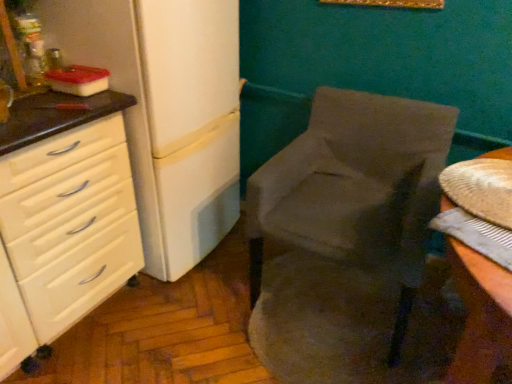
Question: Does white matte refrigerator at left appear on the right side of velvet gray chair at center?

Choices:
 (A) no
 (B) yes

Answer: (A)

Question: Considering the relative positions of white matte refrigerator at left and velvet gray chair at center in the image provided, is white matte refrigerator at left to the left of velvet gray chair at center from the viewer's perspective?

Choices:
 (A) no
 (B) yes

Answer: (B)

Question: From a real-world perspective, is white matte refrigerator at left on velvet gray chair at center?

Choices:
 (A) no
 (B) yes

Answer: (B)

Question: Is white matte refrigerator at left in front of velvet gray chair at center?

Choices:
 (A) yes
 (B) no

Answer: (B)

Question: Can you confirm if white matte refrigerator at left is bigger than velvet gray chair at center?

Choices:
 (A) no
 (B) yes

Answer: (B)

Question: Looking at their shapes, would you say white glossy chest of drawers at left is wider or thinner than velvet gray chair at center?

Choices:
 (A) thin
 (B) wide

Answer: (A)

Question: Considering the positions of white glossy chest of drawers at left and velvet gray chair at center in the image, is white glossy chest of drawers at left taller or shorter than velvet gray chair at center?

Choices:
 (A) short
 (B) tall

Answer: (B)

Question: Considering the positions of point (39, 332) and point (349, 183), is point (39, 332) closer or farther from the camera than point (349, 183)?

Choices:
 (A) closer
 (B) farther

Answer: (A)

Question: From the image's perspective, is white glossy chest of drawers at left located above or below velvet gray chair at center?

Choices:
 (A) below
 (B) above

Answer: (A)

Question: Considering the positions of white glossy chest of drawers at left and white matte refrigerator at left in the image, is white glossy chest of drawers at left bigger or smaller than white matte refrigerator at left?

Choices:
 (A) small
 (B) big

Answer: (A)

Question: From a real-world perspective, is white glossy chest of drawers at left positioned above or below white matte refrigerator at left?

Choices:
 (A) above
 (B) below

Answer: (B)

Question: From the image's perspective, is white glossy chest of drawers at left located above or below white matte refrigerator at left?

Choices:
 (A) above
 (B) below

Answer: (B)

Question: Would you say white glossy chest of drawers at left is inside or outside white matte refrigerator at left?

Choices:
 (A) outside
 (B) inside

Answer: (A)

Question: From a real-world perspective, relative to white matte refrigerator at left, is velvet gray chair at center vertically above or below?

Choices:
 (A) below
 (B) above

Answer: (A)

Question: From the image's perspective, is velvet gray chair at center located above or below white matte refrigerator at left?

Choices:
 (A) below
 (B) above

Answer: (A)